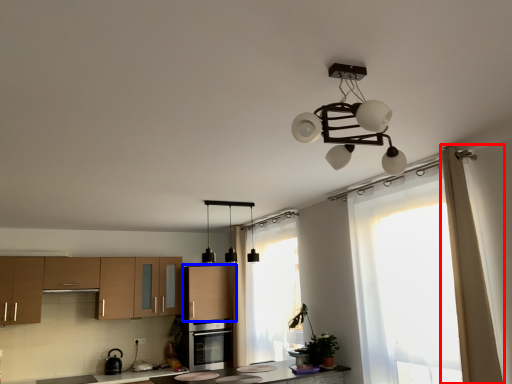
Question: Among these objects, which one is farthest to the camera, curtain (highlighted by a red box) or cabinetry (highlighted by a blue box)?

Choices:
 (A) curtain
 (B) cabinetry

Answer: (B)